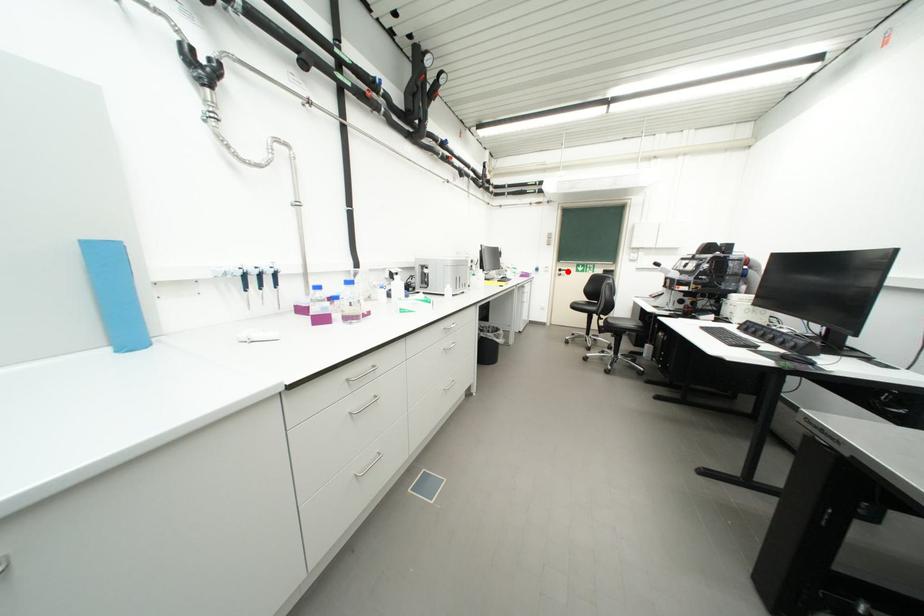
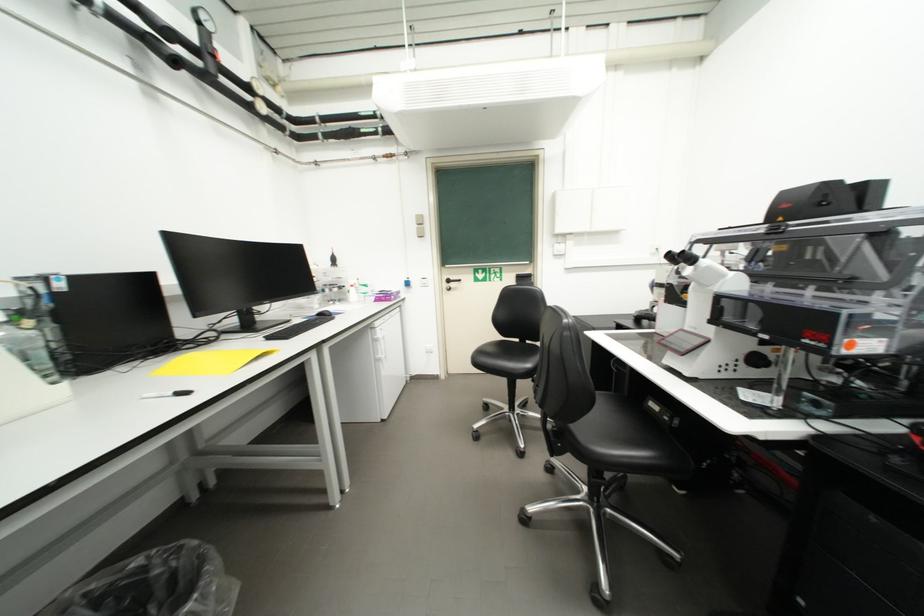
Question: I am providing you with two images of the same scene from different viewpoints. A red point is marked on the first image. Is the red point's position out of view in image 2?

Choices:
 (A) Yes
 (B) No

Answer: (B)